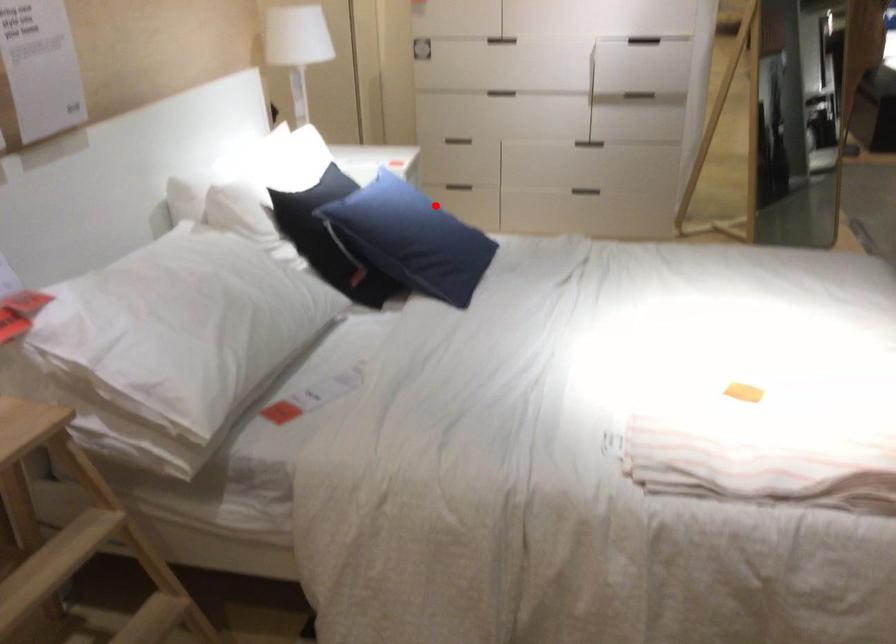
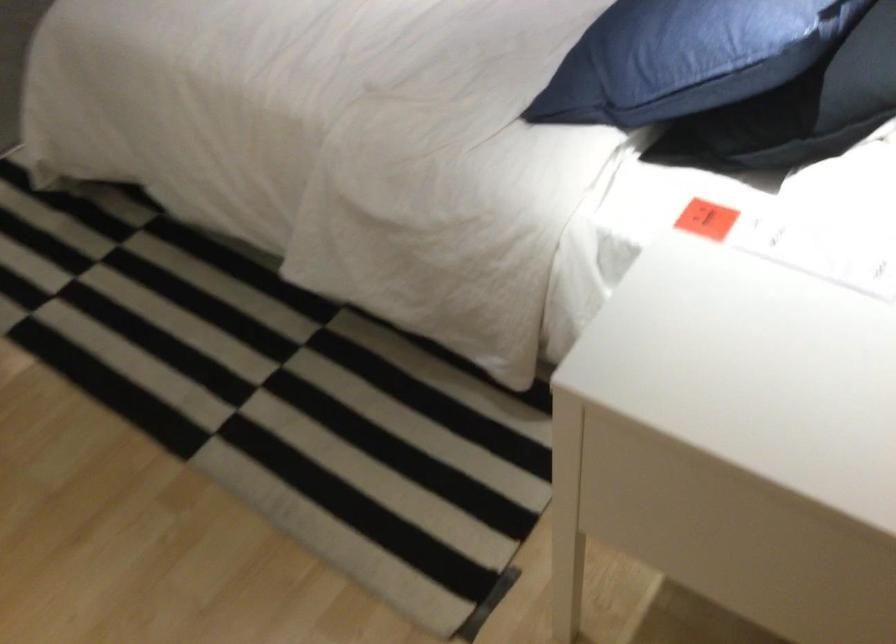
Question: I am providing you with two images of the same scene from different viewpoints. A red point is marked on the first image. Can you still see the location of the red point in image 2?

Choices:
 (A) Yes
 (B) No

Answer: (A)